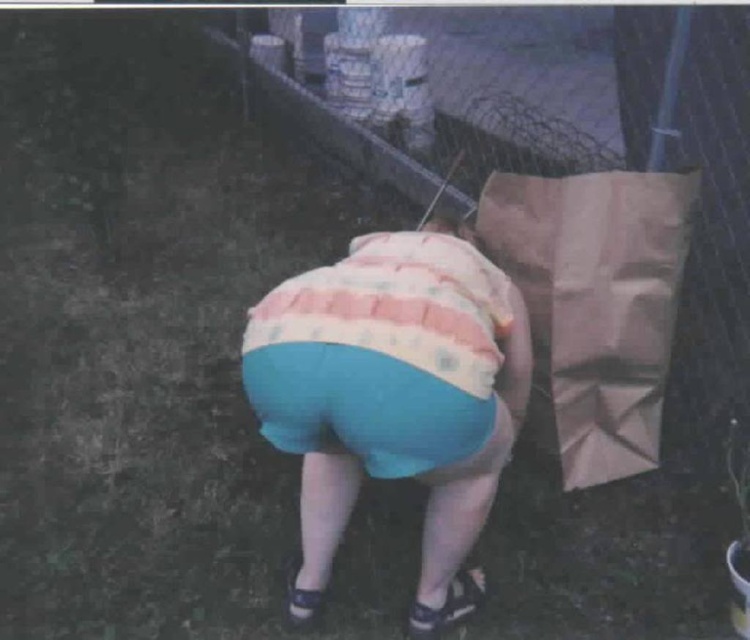
Between point (603, 225) and point (420, 422), which one is positioned in front?

Positioned in front is point (420, 422).

Find the location of a particular element. Image resolution: width=750 pixels, height=640 pixels. metallic chain-link fence at upper center is located at coordinates (594, 211).

Is brown paper bag at right to the left of dark blue leather sandal at lower center from the viewer's perspective?

Incorrect, brown paper bag at right is not on the left side of dark blue leather sandal at lower center.

Is point (555, 340) farther from viewer compared to point (303, 588)?

Yes, it is.

Describe the element at coordinates (596, 305) in the screenshot. This screenshot has width=750, height=640. I see `brown paper bag at right` at that location.

Find the location of a particular element. This screenshot has width=750, height=640. brown paper bag at right is located at coordinates (596, 305).

Does striped cotton shirt at center have a larger size compared to brown paper bag at right?

Correct, striped cotton shirt at center is larger in size than brown paper bag at right.

Who is more forward, (267, 310) or (609, 173)?

Positioned in front is point (267, 310).

At what (x,y) coordinates should I click in order to perform the action: click on striped cotton shirt at center. Please return your answer as a coordinate pair (x, y). Looking at the image, I should click on (393, 387).